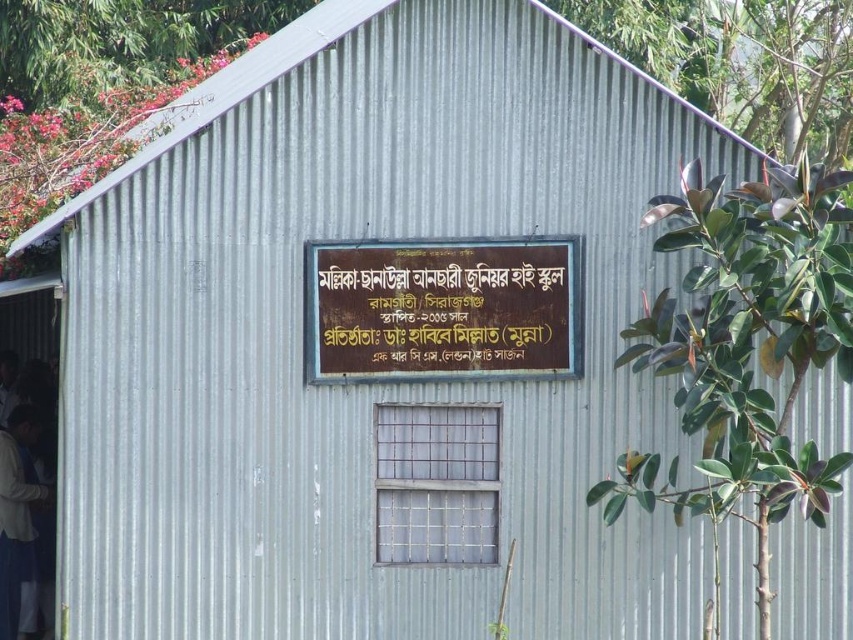
Question: In this image, where is gold polished wood sign at center located relative to white fabric shirt at lower left?

Choices:
 (A) left
 (B) right

Answer: (B)

Question: Is gold polished wood sign at center below white fabric shirt at lower left?

Choices:
 (A) yes
 (B) no

Answer: (B)

Question: Which point is farther from the camera taking this photo?

Choices:
 (A) (16, 580)
 (B) (340, 321)

Answer: (A)

Question: Which point is farther from the camera taking this photo?

Choices:
 (A) (438, 328)
 (B) (45, 490)

Answer: (B)

Question: Which of the following is the farthest from the observer?

Choices:
 (A) (13, 490)
 (B) (335, 352)

Answer: (A)

Question: Considering the relative positions of gold polished wood sign at center and white fabric shirt at lower left in the image provided, where is gold polished wood sign at center located with respect to white fabric shirt at lower left?

Choices:
 (A) left
 (B) right

Answer: (B)